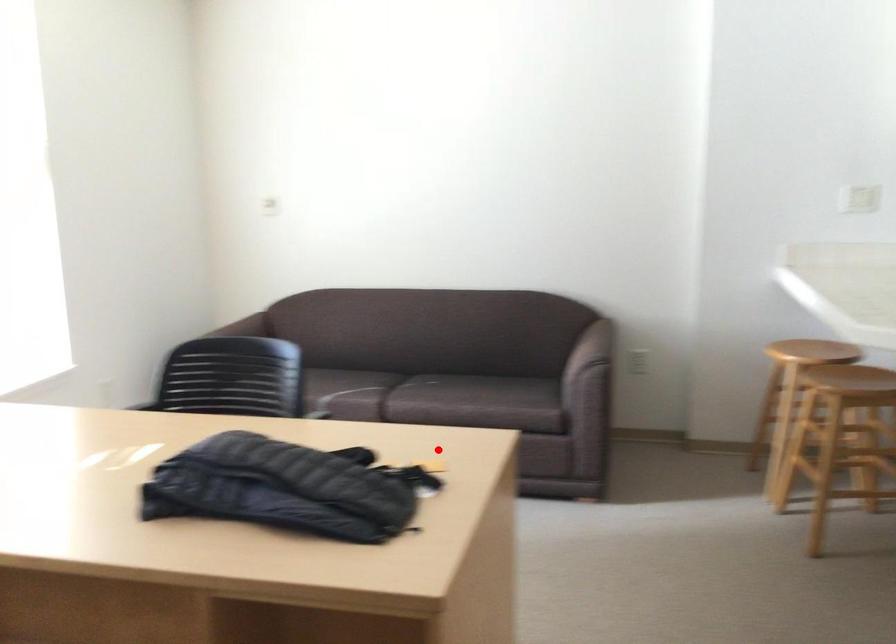
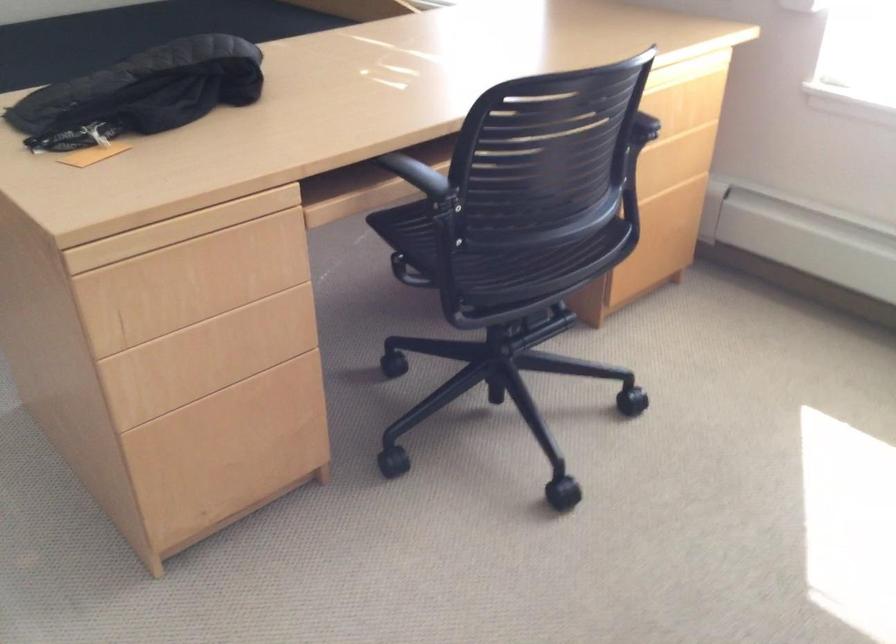
Question: I am providing you with two images of the same scene from different viewpoints. Image1 has a red point marked. In image2, the corresponding 3D location appears at what relative position? Reply with the corresponding letter.

Choices:
 (A) Closer
 (B) Farther

Answer: (A)